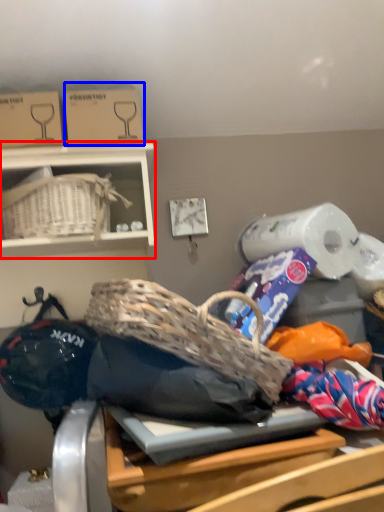
Question: Among these objects, which one is farthest to the camera, furniture (highlighted by a red box) or cardboard box (highlighted by a blue box)?

Choices:
 (A) furniture
 (B) cardboard box

Answer: (B)